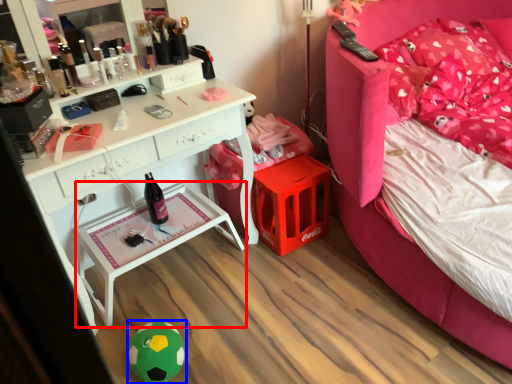
Question: Which point is further to the camera, nightstand (highlighted by a red box) or toy (highlighted by a blue box)?

Choices:
 (A) nightstand
 (B) toy

Answer: (A)